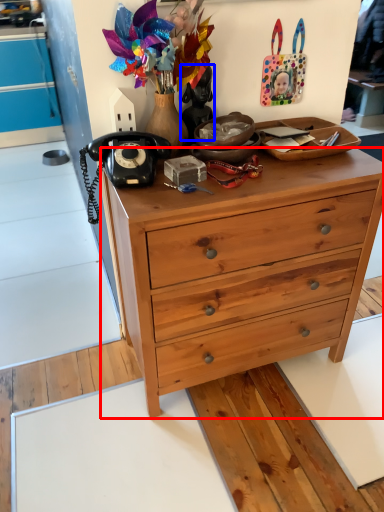
Question: Which point is closer to the camera, desk (highlighted by a red box) or person (highlighted by a blue box)?

Choices:
 (A) desk
 (B) person

Answer: (A)